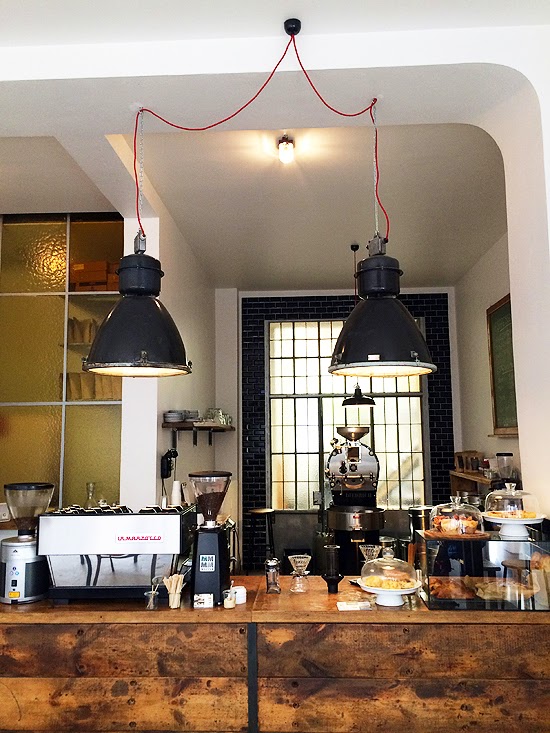
Where is `chalkboard`? chalkboard is located at coordinates (514, 391).